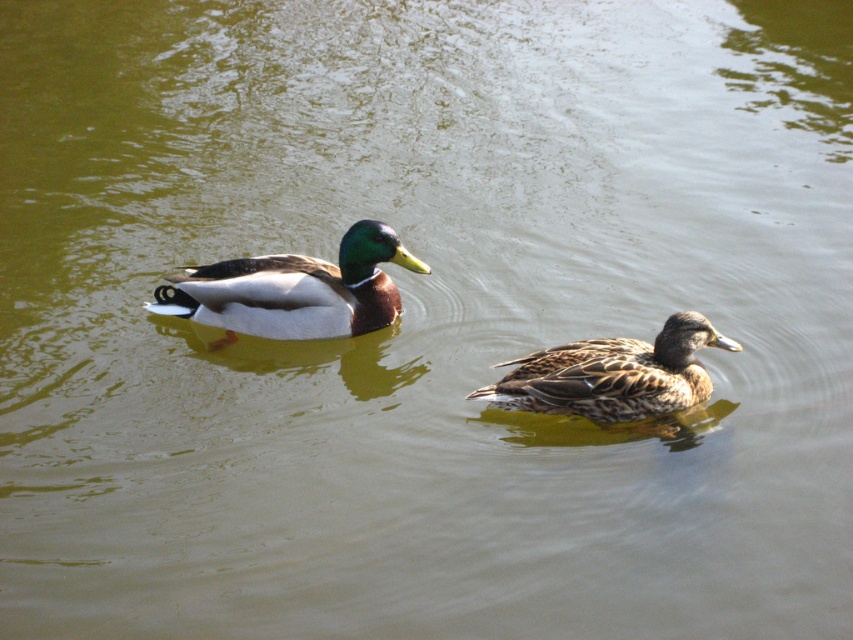
Is shiny brown duck at center smaller than brown speckled feathers at center?

Incorrect, shiny brown duck at center is not smaller in size than brown speckled feathers at center.

Measure the distance between shiny brown duck at center and camera.

shiny brown duck at center is 7.04 meters away from camera.

Find the location of a particular element. This screenshot has height=640, width=853. shiny brown duck at center is located at coordinates (294, 291).